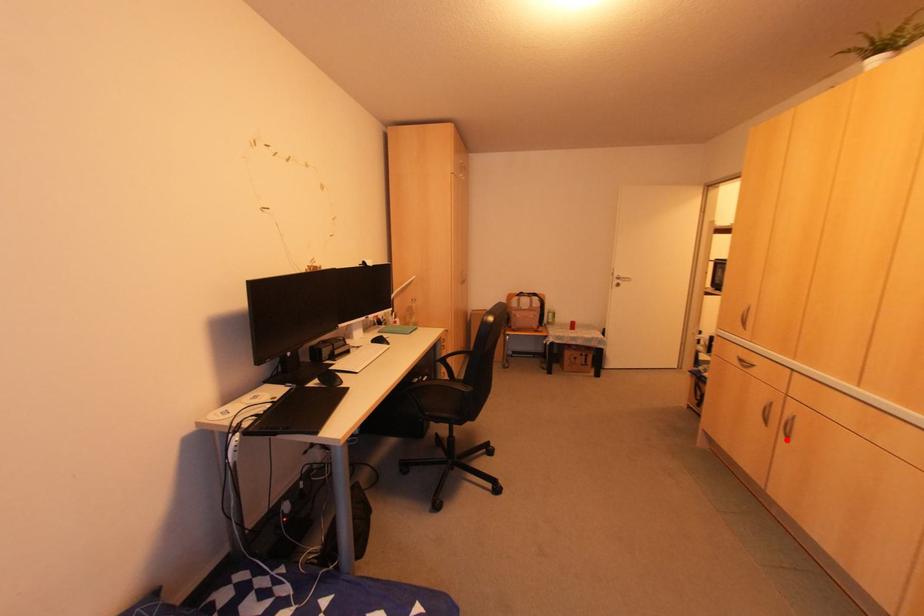
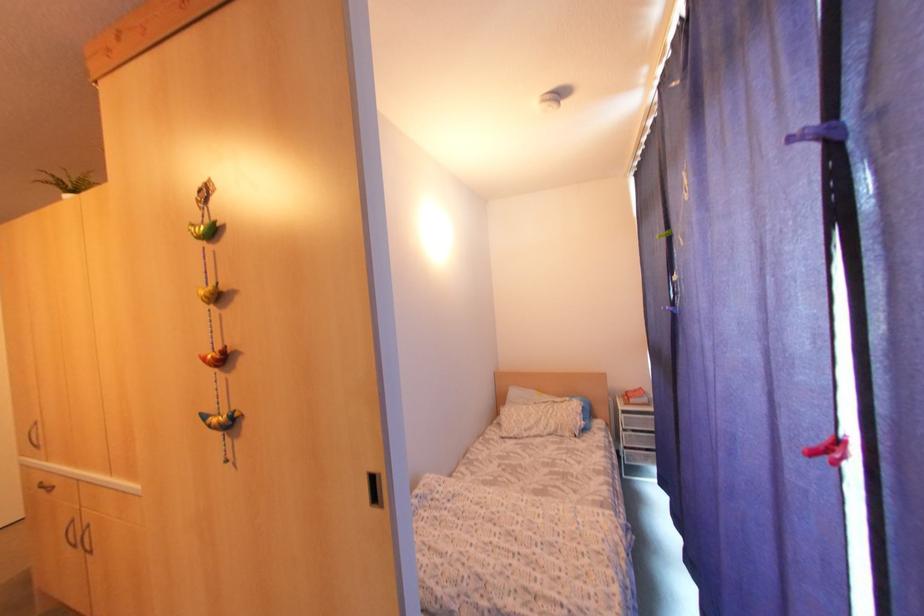
Question: I am providing you with two images of the same scene from different viewpoints. A red point is marked on the first image. Can you still see the location of the red point in image 2?

Choices:
 (A) Yes
 (B) No

Answer: (A)